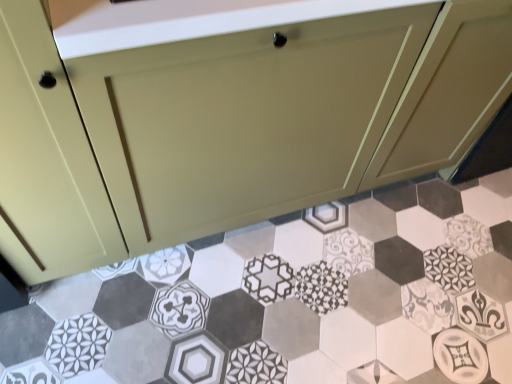
This screenshot has width=512, height=384. In order to click on free spot in front of matte cream cabinet at center in this screenshot , I will do `click(262, 307)`.